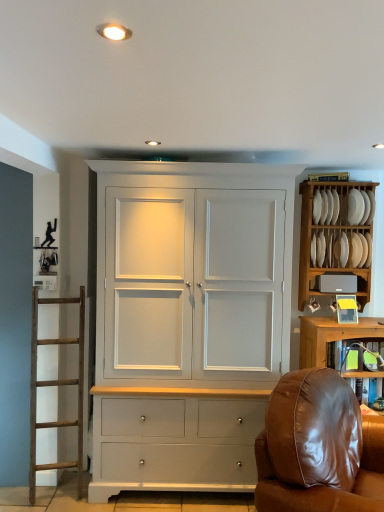
Question: From a real-world perspective, is white painted wood cupboard at center physically above white glossy plate at upper right, which is the second plate in right-to-left order?

Choices:
 (A) no
 (B) yes

Answer: (A)

Question: Does white painted wood cupboard at center have a greater width compared to white glossy plate at upper right, arranged as the first plate when viewed from the left?

Choices:
 (A) yes
 (B) no

Answer: (A)

Question: Is white painted wood cupboard at center not inside white glossy plate at upper right, which is the second plate in right-to-left order?

Choices:
 (A) yes
 (B) no

Answer: (A)

Question: Does white painted wood cupboard at center have a smaller size compared to white glossy plate at upper right, arranged as the first plate when viewed from the left?

Choices:
 (A) yes
 (B) no

Answer: (B)

Question: Would you say white painted wood cupboard at center contains white glossy plate at upper right, arranged as the first plate when viewed from the left?

Choices:
 (A) yes
 (B) no

Answer: (B)

Question: Does white painted wood cupboard at center have a greater height compared to white glossy plate at upper right, arranged as the first plate when viewed from the left?

Choices:
 (A) yes
 (B) no

Answer: (A)

Question: Can you confirm if matte gray speaker at upper right is wider than white glossy plate at upper right, arranged as the first plate when viewed from the left?

Choices:
 (A) no
 (B) yes

Answer: (A)

Question: Is matte gray speaker at upper right to the right of white glossy plate at upper right, which is the second plate in right-to-left order, from the viewer's perspective?

Choices:
 (A) yes
 (B) no

Answer: (A)

Question: Does matte gray speaker at upper right have a larger size compared to white glossy plate at upper right, arranged as the first plate when viewed from the left?

Choices:
 (A) no
 (B) yes

Answer: (B)

Question: Is matte gray speaker at upper right aimed at white glossy plate at upper right, which is the second plate in right-to-left order?

Choices:
 (A) yes
 (B) no

Answer: (B)

Question: Is matte gray speaker at upper right positioned in front of white glossy plate at upper right, which is the second plate in right-to-left order?

Choices:
 (A) yes
 (B) no

Answer: (B)

Question: Would you say matte gray speaker at upper right is a long distance from white glossy plate at upper right, arranged as the first plate when viewed from the left?

Choices:
 (A) no
 (B) yes

Answer: (A)

Question: From the image's perspective, is brown leather chair at lower right under white wood plate rack at upper right?

Choices:
 (A) no
 (B) yes

Answer: (B)